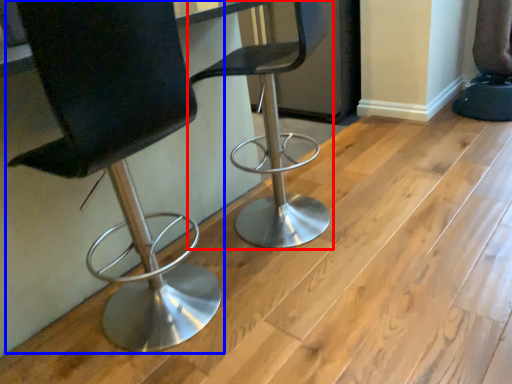
Question: Among these objects, which one is farthest to the camera, chair (highlighted by a red box) or chair (highlighted by a blue box)?

Choices:
 (A) chair
 (B) chair

Answer: (A)